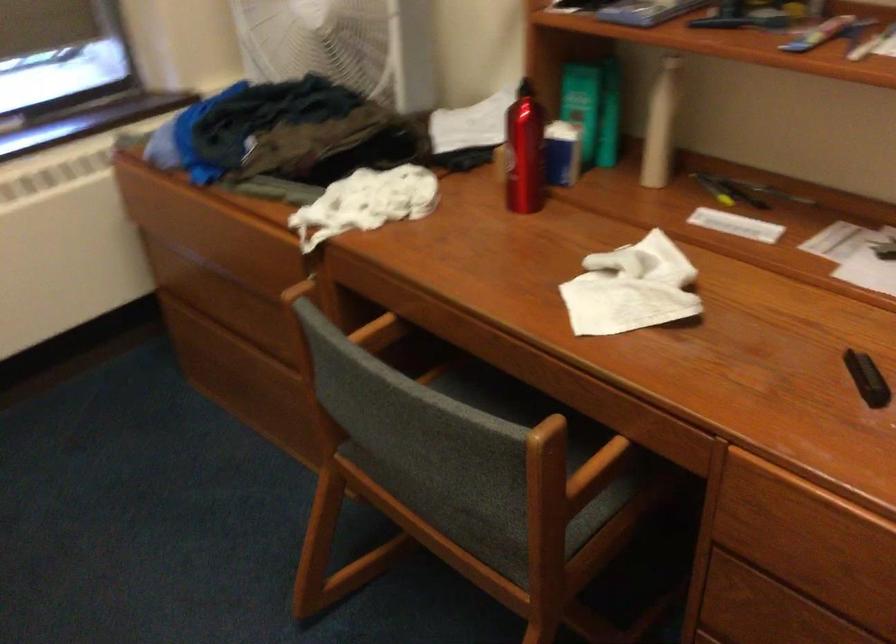
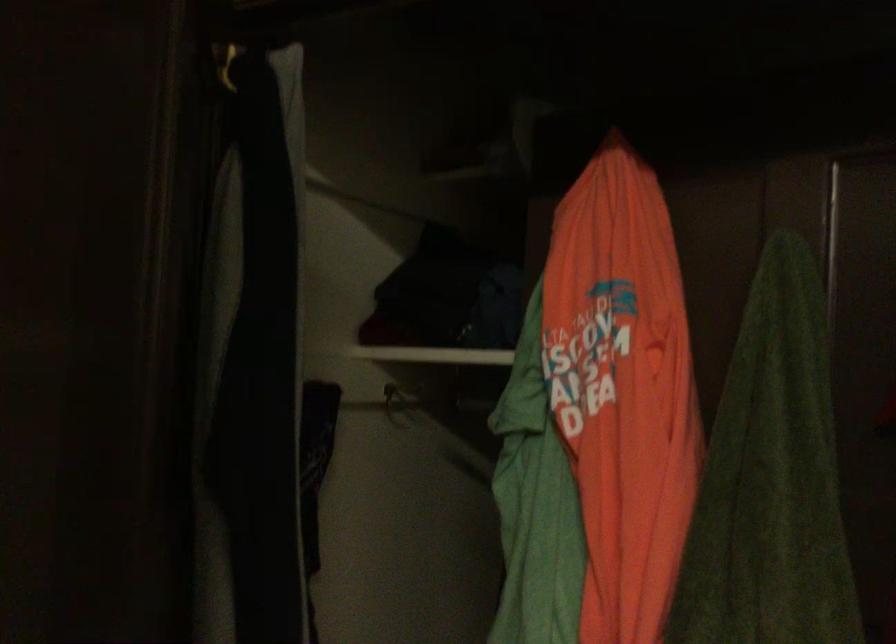
Question: The camera is either moving clockwise (left) or counter-clockwise (right) around the object. The first image is from the beginning of the video and the second image is from the end. Is the camera moving left or right when shooting the video?

Choices:
 (A) Left
 (B) Right

Answer: (A)